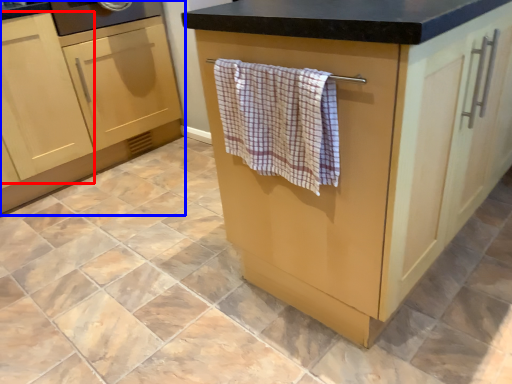
Question: Which object is closer to the camera taking this photo, cabinetry (highlighted by a red box) or cabinetry (highlighted by a blue box)?

Choices:
 (A) cabinetry
 (B) cabinetry

Answer: (A)